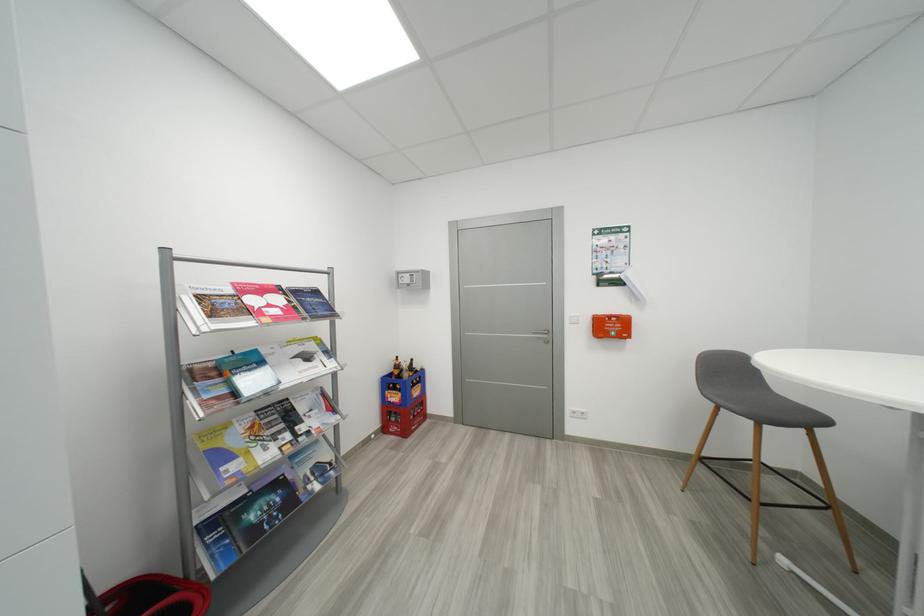
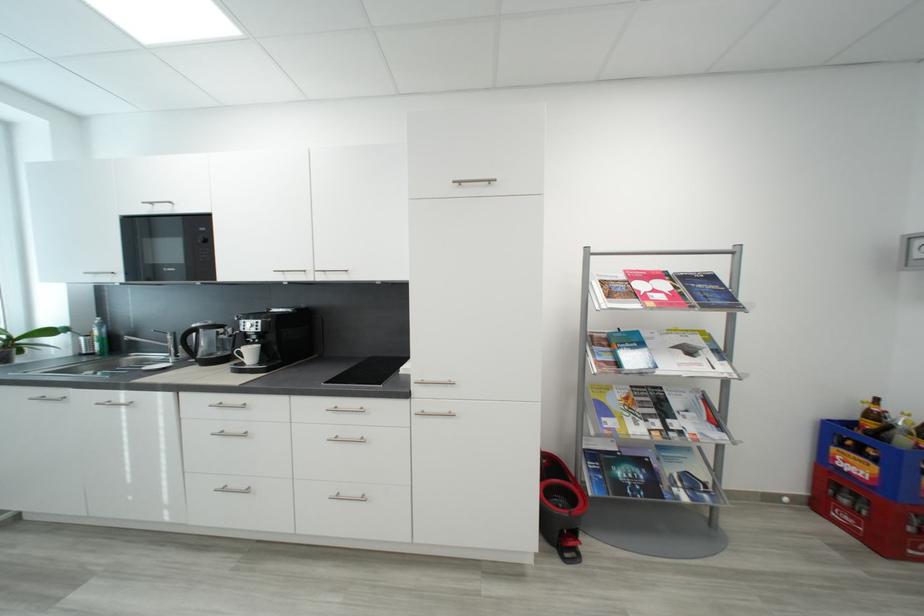
Where in the second image is the point corresponding to the point at 404,369 from the first image?

(881, 418)